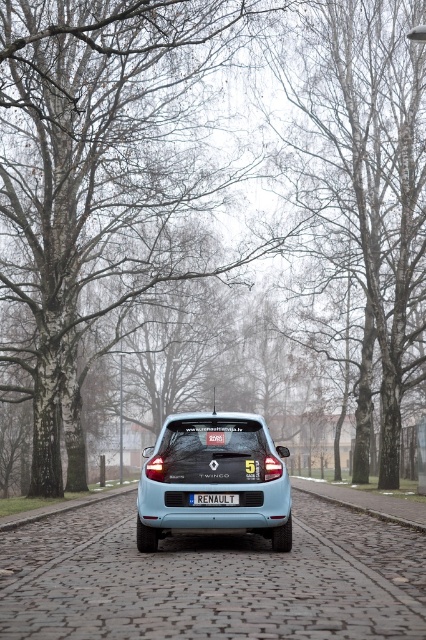
Question: Estimate the real-world distances between objects in this image. Which object is farther from the cobblestone at lower center?

Choices:
 (A) blue plastic license plate at center
 (B) light blue matte hatchback at center

Answer: (A)

Question: Can you confirm if light blue matte hatchback at center is positioned above cobblestone at lower center?

Choices:
 (A) no
 (B) yes

Answer: (B)

Question: Is light blue matte hatchback at center closer to the viewer compared to cobblestone pavement at center?

Choices:
 (A) no
 (B) yes

Answer: (B)

Question: Considering the real-world distances, which object is closest to the cobblestone at lower center?

Choices:
 (A) blue plastic license plate at center
 (B) light blue matte hatchback at center
 (C) cobblestone pavement at center

Answer: (B)

Question: Is cobblestone pavement at center to the right of blue plastic license plate at center from the viewer's perspective?

Choices:
 (A) yes
 (B) no

Answer: (A)

Question: Which object appears closest to the camera in this image?

Choices:
 (A) light blue matte hatchback at center
 (B) cobblestone pavement at center
 (C) blue plastic license plate at center

Answer: (A)